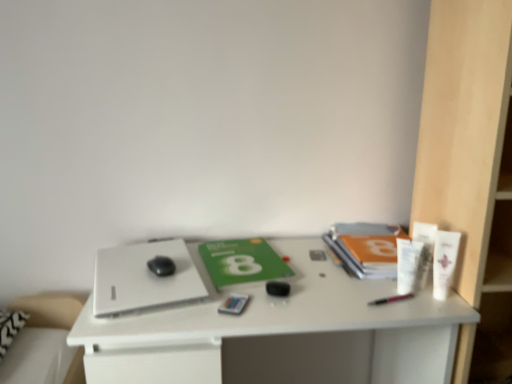
The width and height of the screenshot is (512, 384). Identify the location of vacant space situated on the left part of black matte mouse at center. (119, 269).